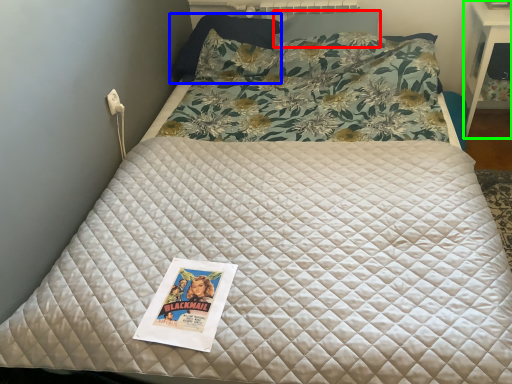
Question: Estimate the real-world distances between objects in this image. Which object is closer to pillow (highlighted by a red box), pillow (highlighted by a blue box) or table (highlighted by a green box)?

Choices:
 (A) pillow
 (B) table

Answer: (A)